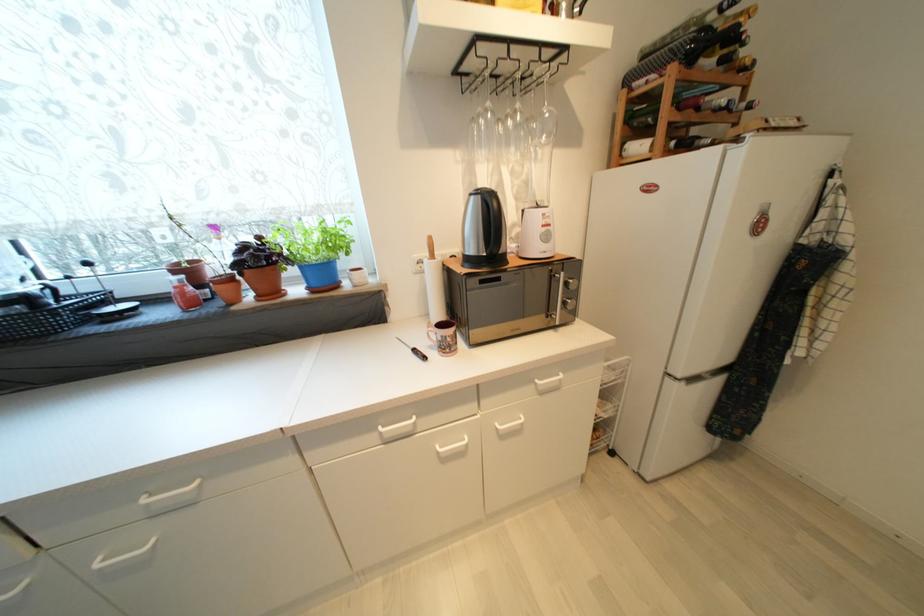
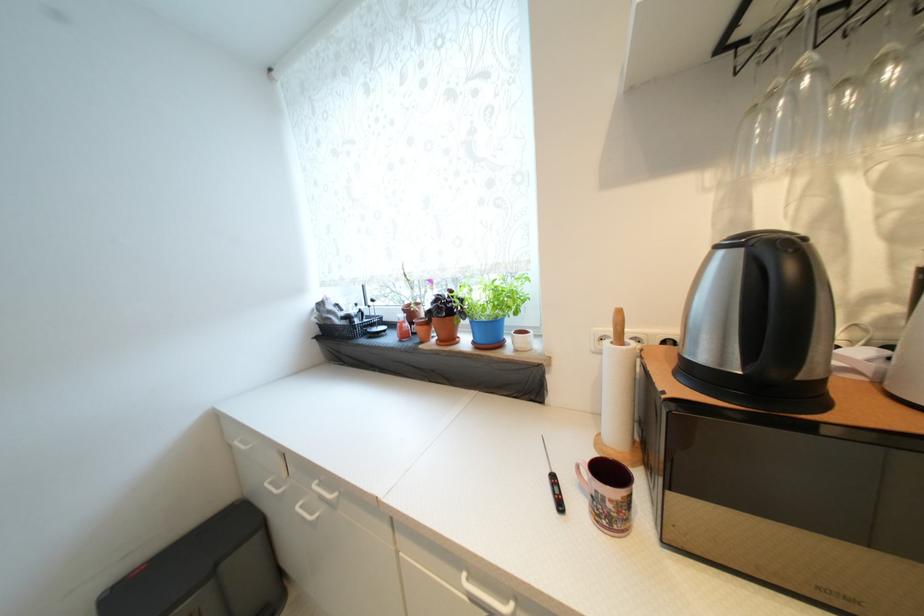
In the second image, find the point that corresponds to point 435,349 in the first image.

(586, 488)